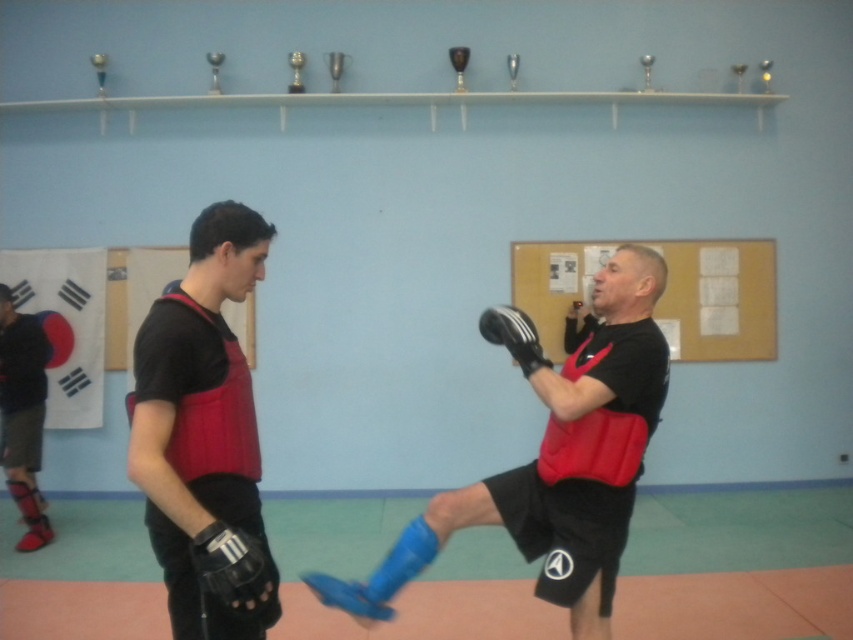
Question: Does matte black boxing glove at center come behind matte black vest at center?

Choices:
 (A) yes
 (B) no

Answer: (A)

Question: Is matte black boxing glove at center to the left of blue leather boxing glove at lower center from the viewer's perspective?

Choices:
 (A) no
 (B) yes

Answer: (A)

Question: Where is matte black vest at center located in relation to black leather boxing glove at lower left in the image?

Choices:
 (A) left
 (B) right

Answer: (A)

Question: Which object is closer to the camera taking this photo?

Choices:
 (A) matte black shin guard at lower left
 (B) matte black vest at center
 (C) black leather boxing glove at lower left

Answer: (C)

Question: Which point is farther to the camera?

Choices:
 (A) matte black shin guard at lower left
 (B) blue leather boxing glove at lower center
 (C) matte black boxing glove at center
 (D) matte black vest at center

Answer: (A)

Question: Which of the following is the closest to the observer?

Choices:
 (A) matte black shin guard at lower left
 (B) blue leather boxing glove at lower center

Answer: (B)